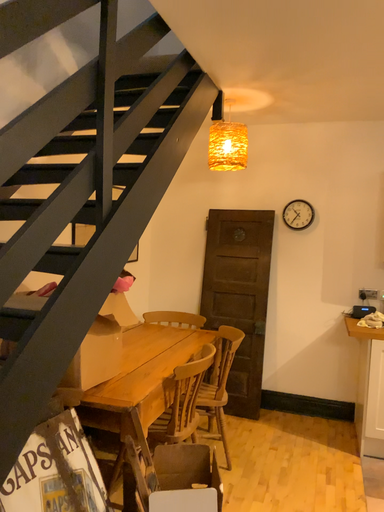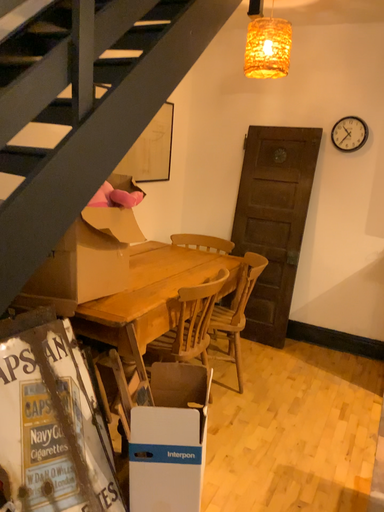
Question: How did the camera likely rotate when shooting the video?

Choices:
 (A) rotated downward
 (B) rotated upward

Answer: (A)